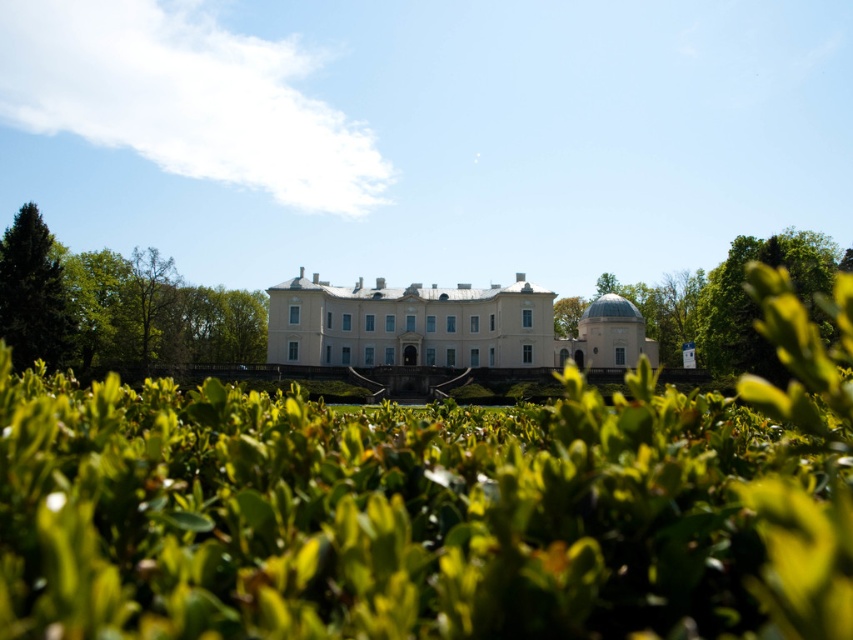
You are standing at the entrance of the grand classical building and see a point marked at coordinates (734, 301). Based on the image, what does this point indicate?

The point at coordinates (734, 301) indicates the location of the green leafy bush at right.